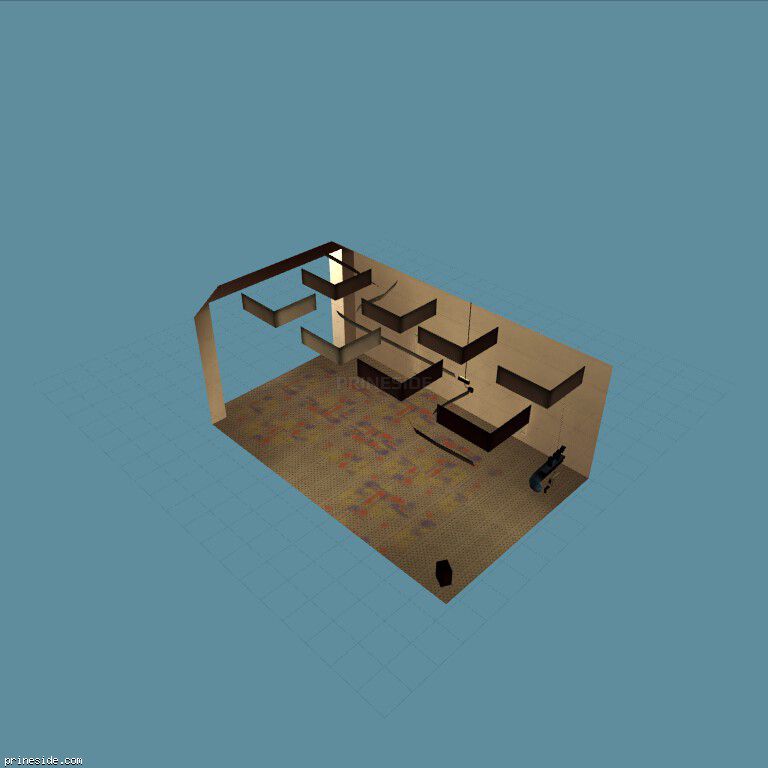
Where is `grout`? The image size is (768, 768). grout is located at coordinates (243, 607).